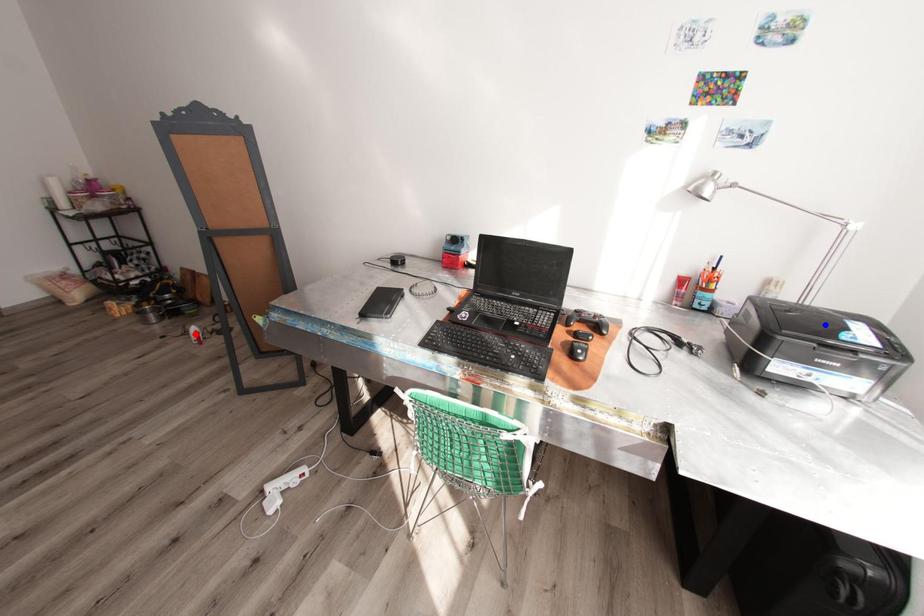
Question: In the image, two points are highlighted. Which point is nearer to the camera? Reply with the corresponding letter.

Choices:
 (A) blue point
 (B) red point

Answer: (A)